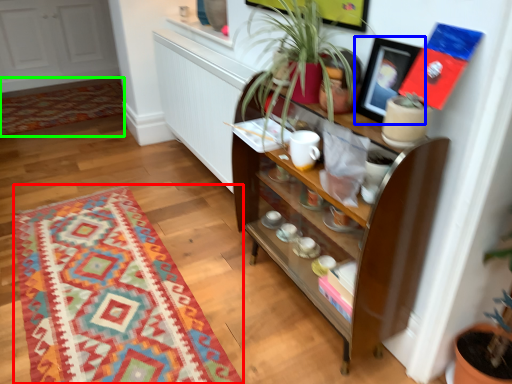
Question: Which is nearer to the mat (highlighted by a red box)? picture frame (highlighted by a blue box) or mat (highlighted by a green box).

Choices:
 (A) picture frame
 (B) mat

Answer: (A)